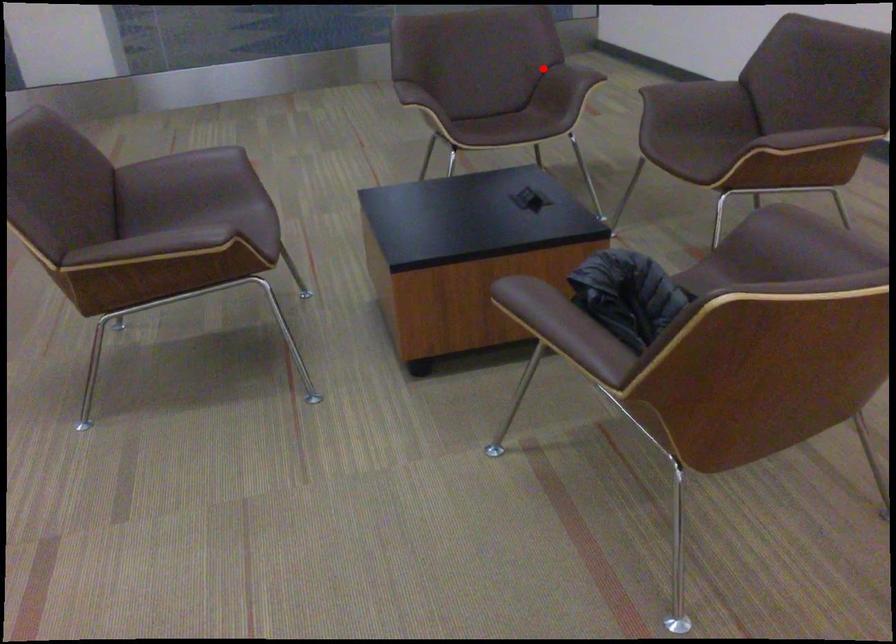
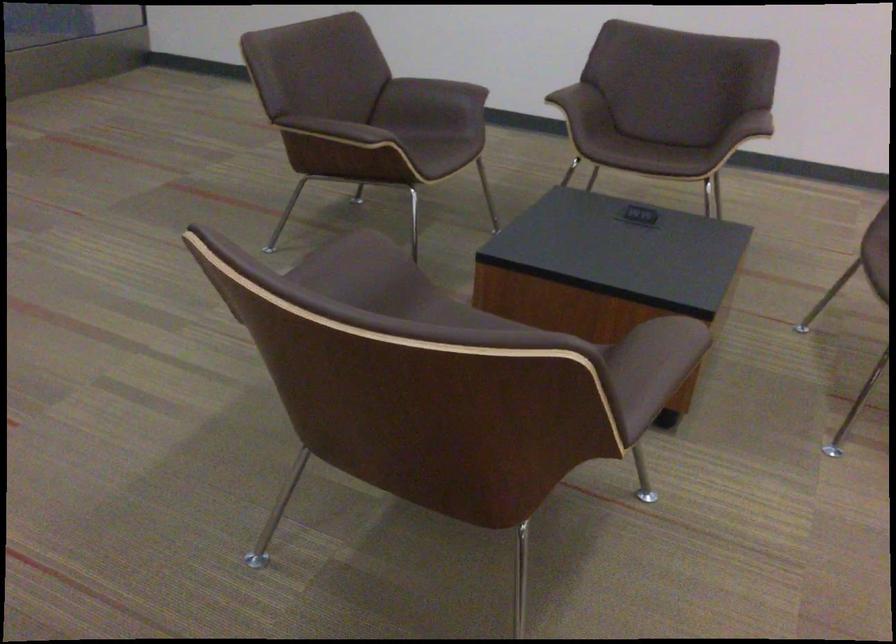
Question: A red point is marked in image1. In image2, is the corresponding 3D point closer to the camera or farther? Reply with the corresponding letter.

Choices:
 (A) The corresponding 3D point is closer.
 (B) The corresponding 3D point is farther.

Answer: (A)